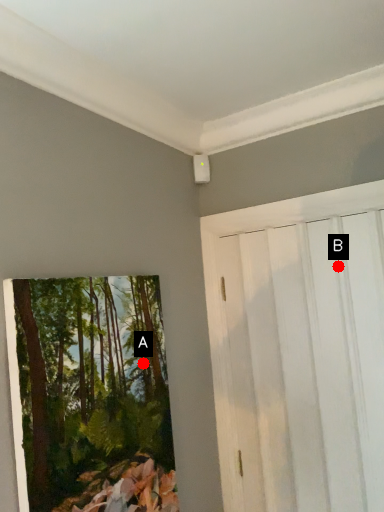
Question: Two points are circled on the image, labeled by A and B beside each circle. Which point appears closest to the camera in this image?

Choices:
 (A) A is closer
 (B) B is closer

Answer: (A)